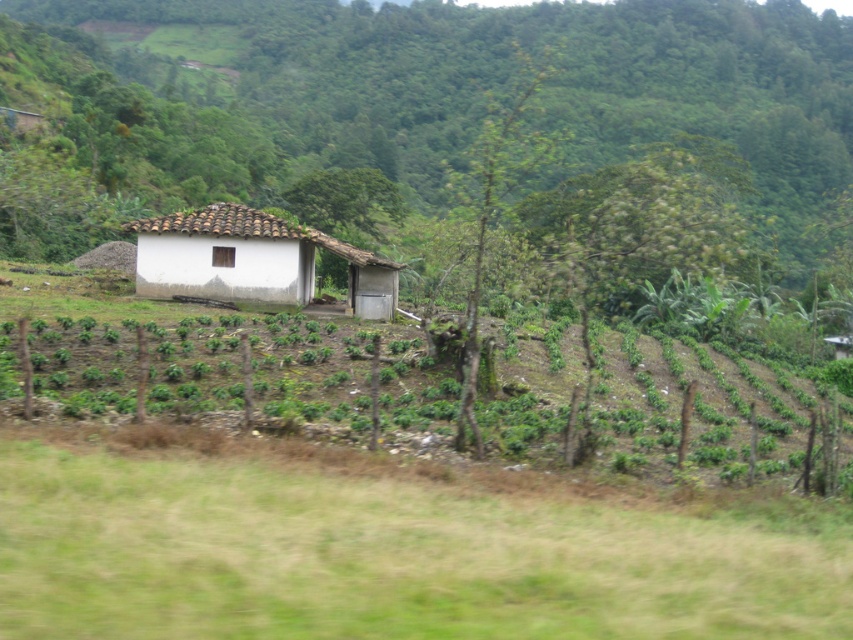
Question: Does white clay hut at center appear over transparent glass window at center?

Choices:
 (A) no
 (B) yes

Answer: (A)

Question: Which point is farther to the camera?

Choices:
 (A) transparent glass window at center
 (B) white clay hut at center
 (C) green leafy plants at center

Answer: (A)

Question: Observing the image, what is the correct spatial positioning of white matte house at center in reference to green leafy plants at center?

Choices:
 (A) below
 (B) above

Answer: (B)

Question: Which object appears closest to the camera in this image?

Choices:
 (A) transparent glass window at center
 (B) white clay hut at center
 (C) white matte house at center
 (D) green leafy plants at center

Answer: (D)

Question: Can you confirm if white matte house at center is thinner than transparent glass window at center?

Choices:
 (A) no
 (B) yes

Answer: (A)

Question: Which of these objects is positioned farthest from the white matte house at center?

Choices:
 (A) green leafy plants at center
 (B) white clay hut at center

Answer: (B)